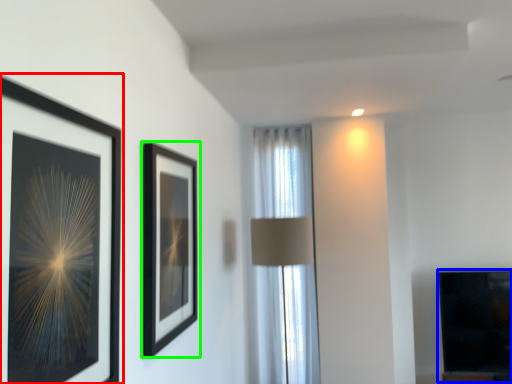
Question: Which is nearer to the picture frame (highlighted by a red box)? fireplace (highlighted by a blue box) or picture frame (highlighted by a green box).

Choices:
 (A) fireplace
 (B) picture frame

Answer: (B)